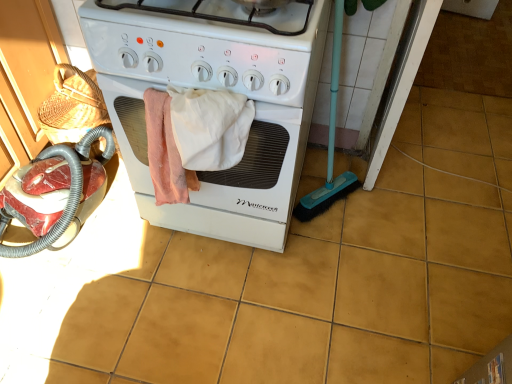
From the picture: Measure the distance between point (251,36) and camera.

Point (251,36) and camera are 85.80 centimeters apart.

Locate an element on the screen. This screenshot has height=384, width=512. white matte stove at center is located at coordinates (214, 88).

Measure the distance between white glossy gas stove at center and camera.

The depth of white glossy gas stove at center is 84.40 centimeters.

Locate an element on the screen. Image resolution: width=512 pixels, height=384 pixels. white cotton towel at center is located at coordinates (210, 127).

Find the location of a particular element. The height and width of the screenshot is (384, 512). white matte stove at center is located at coordinates (214, 88).

Is white matte stove at center looking in the opposite direction of white cotton towel at center?

No, white matte stove at center's orientation is not away from white cotton towel at center.

From the image's perspective, between white matte stove at center and white cotton towel at center, who is located below?

white cotton towel at center, from the image's perspective.

From a real-world perspective, which is physically above, white matte stove at center or white cotton towel at center?

white cotton towel at center is physically above.

What are the coordinates of `gas stove that appears in front of the white cotton towel at center` in the screenshot? It's located at (204, 45).

Between white cotton towel at center and white glossy gas stove at center, which one has less height?

white glossy gas stove at center.

What's the angular difference between white cotton towel at center and white glossy gas stove at center's facing directions?

white cotton towel at center and white glossy gas stove at center are facing 2.71 degrees away from each other.

Could you tell me if white cotton towel at center is turned towards white glossy gas stove at center?

No, white cotton towel at center is not turned towards white glossy gas stove at center.

Is white glossy gas stove at center to the left or to the right of white cotton towel at center in the image?

white glossy gas stove at center is positioned on white cotton towel at center's right side.

Does point (304, 29) appear closer or farther from the camera than point (207, 145)?

Clearly, point (304, 29) is closer to the camera than point (207, 145).

Is white glossy gas stove at center not close to white cotton towel at center?

No, there isn't a large distance between white glossy gas stove at center and white cotton towel at center.

Can you confirm if white cotton towel at center is wider than yellow matte tile at center?

In fact, white cotton towel at center might be narrower than yellow matte tile at center.

Is white cotton towel at center further to camera compared to yellow matte tile at center?

That is False.

From the image's perspective, between white cotton towel at center and yellow matte tile at center, who is located below?

From the image's view, yellow matte tile at center is below.

Does white cotton towel at center contain yellow matte tile at center?

That's incorrect, yellow matte tile at center is not inside white cotton towel at center.

Relative to white glossy gas stove at center, is white matte stove at center in front or behind?

white matte stove at center is positioned farther from the viewer than white glossy gas stove at center.

Can you tell me how much white matte stove at center and white glossy gas stove at center differ in facing direction?

The angle between the facing direction of white matte stove at center and the facing direction of white glossy gas stove at center is 0.000373 degrees.

From a real-world perspective, is white matte stove at center on white glossy gas stove at center?

Actually, white matte stove at center is physically below white glossy gas stove at center in the real world.

Does yellow matte tile at center have a greater width compared to white matte stove at center?

In fact, yellow matte tile at center might be narrower than white matte stove at center.

Which point is more forward, (480, 201) or (272, 193)?

The point (272, 193) is closer.

At what (x,y) coordinates should I click in order to perform the action: click on tile on the right of white matte stove at center. Please return your answer as a coordinate pair (x, y). Looking at the image, I should click on (460, 189).

Is yellow matte tile at center bigger or smaller than white matte stove at center?

yellow matte tile at center is smaller than white matte stove at center.

Is white cotton towel at center further to camera compared to white matte stove at center?

That is False.

Considering the sizes of white cotton towel at center and white matte stove at center in the image, is white cotton towel at center bigger or smaller than white matte stove at center?

Considering their sizes, white cotton towel at center takes up less space than white matte stove at center.

Could you tell me if white cotton towel at center is facing white matte stove at center?

A: No, white cotton towel at center is not turned towards white matte stove at center.

Measure the distance from white cotton towel at center to white matte stove at center.

white cotton towel at center and white matte stove at center are 7.53 inches apart from each other.

The width and height of the screenshot is (512, 384). In the image, there is a white matte stove at center. Find the location of `bath towel below it (from the image's perspective)`. bath towel below it (from the image's perspective) is located at coordinates (210, 127).

This screenshot has width=512, height=384. What are the coordinates of `gas stove above the white cotton towel at center (from the image's perspective)` in the screenshot? It's located at (204, 45).

Estimate the real-world distances between objects in this image. Which object is further from white cotton towel at center, yellow matte tile at center or white matte stove at center?

The object further to white cotton towel at center is yellow matte tile at center.

Considering their positions, is white glossy gas stove at center positioned closer to white matte stove at center than white cotton towel at center?

white glossy gas stove at center lies closer to white matte stove at center than the other object.

Which object lies nearer to the anchor point yellow matte tile at center, white cotton towel at center or white glossy gas stove at center?

Among the two, white cotton towel at center is located nearer to yellow matte tile at center.

Which object lies nearer to the anchor point white cotton towel at center, white matte stove at center or yellow matte tile at center?

white matte stove at center is closer to white cotton towel at center.

From the image, which object appears to be farther from yellow matte tile at center, white glossy gas stove at center or white cotton towel at center?

white glossy gas stove at center is positioned further to the anchor yellow matte tile at center.

Considering their positions, is yellow matte tile at center positioned further to white matte stove at center than white glossy gas stove at center?

The object further to white matte stove at center is yellow matte tile at center.

Estimate the real-world distances between objects in this image. Which object is closer to white matte stove at center, yellow matte tile at center or white cotton towel at center?

white cotton towel at center.

Estimate the real-world distances between objects in this image. Which object is further from white cotton towel at center, white matte stove at center or white glossy gas stove at center?

white matte stove at center.

The width and height of the screenshot is (512, 384). I want to click on gas stove between white cotton towel at center and yellow matte tile at center in the horizontal direction, so click(x=204, y=45).

The height and width of the screenshot is (384, 512). I want to click on home appliance that lies between white glossy gas stove at center and white cotton towel at center from top to bottom, so click(214, 88).

You are a GUI agent. You are given a task and a screenshot of the screen. Output one action in this format:
    pyautogui.click(x=<x>, y=<y>)
    Task: Click on the home appliance between white cotton towel at center and yellow matte tile at center
    The image size is (512, 384).
    Given the screenshot: What is the action you would take?
    pyautogui.click(x=214, y=88)

Locate an element on the screen. Image resolution: width=512 pixels, height=384 pixels. home appliance between white glossy gas stove at center and yellow matte tile at center from left to right is located at coordinates (214, 88).